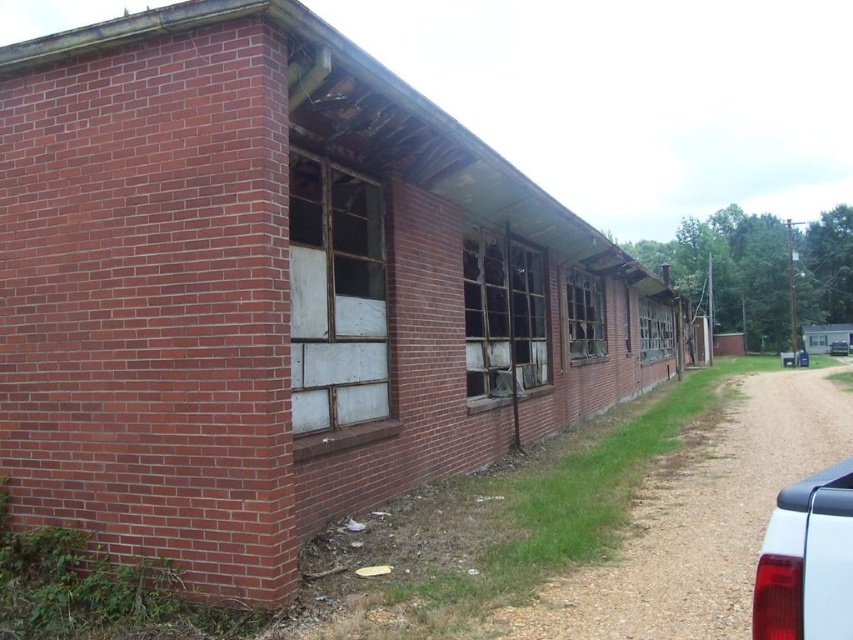
Question: Based on their relative distances, which object is farther from the matte red tail light at lower right?

Choices:
 (A) clear glass window at center
 (B) transparent glass window at center

Answer: (A)

Question: Based on their relative distances, which object is farther from the charred wood window at center?

Choices:
 (A) white glossy car at right
 (B) matte red tail light at lower right

Answer: (A)

Question: Does brown gravel dirt track at lower right have a greater width compared to charred wood window at center?

Choices:
 (A) no
 (B) yes

Answer: (B)

Question: Which object is the farthest from the clear glass window at center?

Choices:
 (A) brown gravel dirt track at lower right
 (B) transparent glass window at center
 (C) white frosted glass window at center

Answer: (C)

Question: Is brown gravel dirt track at lower right wider than white frosted glass window at center?

Choices:
 (A) no
 (B) yes

Answer: (B)

Question: Can you confirm if white frosted glass window at center is positioned to the right of matte red tail light at lower right?

Choices:
 (A) no
 (B) yes

Answer: (A)